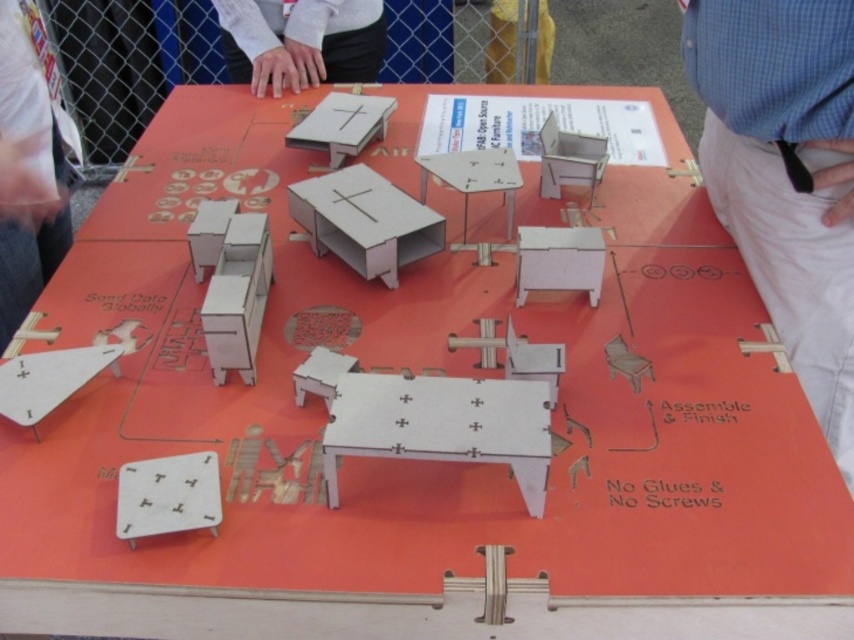
This screenshot has height=640, width=854. What do you see at coordinates (442, 426) in the screenshot?
I see `white matte table at center` at bounding box center [442, 426].

From the picture: Between white matte table at center and pink fabric at left, which one has more height?

Standing taller between the two is pink fabric at left.

The height and width of the screenshot is (640, 854). Describe the element at coordinates (442, 426) in the screenshot. I see `white matte table at center` at that location.

You are a GUI agent. You are given a task and a screenshot of the screen. Output one action in this format:
    pyautogui.click(x=<x>, y=<y>)
    Task: Click on the white matte table at center
    The image size is (854, 640).
    Given the screenshot: What is the action you would take?
    (x=442, y=426)

Does white matte table at center come behind matte wood table at center?

No, it is not.

Does white matte table at center have a smaller size compared to matte wood table at center?

Yes, white matte table at center is smaller than matte wood table at center.

From the picture: Who is more distant from viewer, (332, 474) or (488, 156)?

The point (488, 156) is behind.

Find the location of a particular element. white matte table at center is located at coordinates (442, 426).

Does point (1, 115) come farther from viewer compared to point (332, 6)?

No, (1, 115) is closer to viewer.

Does point (10, 333) come closer to viewer compared to point (314, 51)?

Yes.

At what (x,y) coordinates should I click in order to perform the action: click on pink fabric at left. Please return your answer as a coordinate pair (x, y). Image resolution: width=854 pixels, height=640 pixels. Looking at the image, I should click on (27, 177).